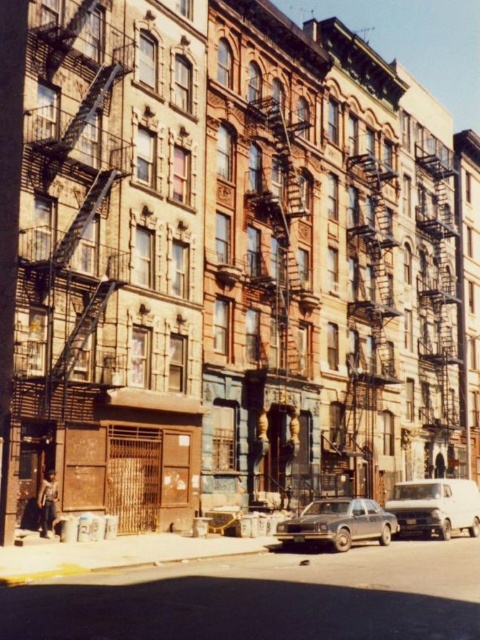
Question: Which of the following is the closest to the observer?

Choices:
 (A) (383, 522)
 (B) (296, 314)
 (C) (410, 525)

Answer: (A)

Question: Is white matte van at center thinner than matte gray sedan at center?

Choices:
 (A) yes
 (B) no

Answer: (B)

Question: Which of the following is the closest to the observer?

Choices:
 (A) (365, 502)
 (B) (275, 164)

Answer: (A)

Question: From the image, what is the correct spatial relationship of white matte van at center in relation to matte gray sedan at center?

Choices:
 (A) below
 (B) above

Answer: (A)

Question: Based on their relative distances, which object is farther from the matte gray sedan at center?

Choices:
 (A) white matte van at center
 (B) rusty metal fire escape at center

Answer: (B)

Question: Is white matte van at center below matte gray sedan at center?

Choices:
 (A) no
 (B) yes

Answer: (B)